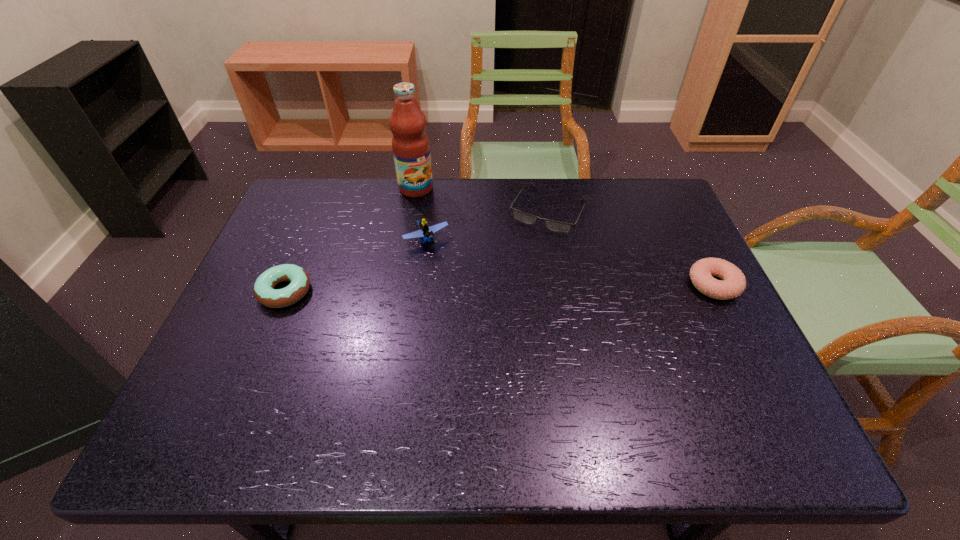
At what (x,y) coordinates should I click in order to perform the action: click on vacant spot on the desktop that is between the leftmost object and the right doughnut and is positioned on the front-facing side of the spectacles. Please return your answer as a coordinate pair (x, y). The image size is (960, 540). Looking at the image, I should click on 505,288.

You are a GUI agent. You are given a task and a screenshot of the screen. Output one action in this format:
    pyautogui.click(x=<x>, y=<y>)
    Task: Click on the free space on the desktop that is between the left doughnut and the right doughnut and is positioned on the front-facing side of the Lego
    Image resolution: width=960 pixels, height=540 pixels.
    Given the screenshot: What is the action you would take?
    pyautogui.click(x=458, y=289)

Image resolution: width=960 pixels, height=540 pixels. Find the location of `vacant space on the desktop that is between the left doughnut and the right doughnut and is positioned on the front label of the tallest object`. vacant space on the desktop that is between the left doughnut and the right doughnut and is positioned on the front label of the tallest object is located at coordinates (500, 288).